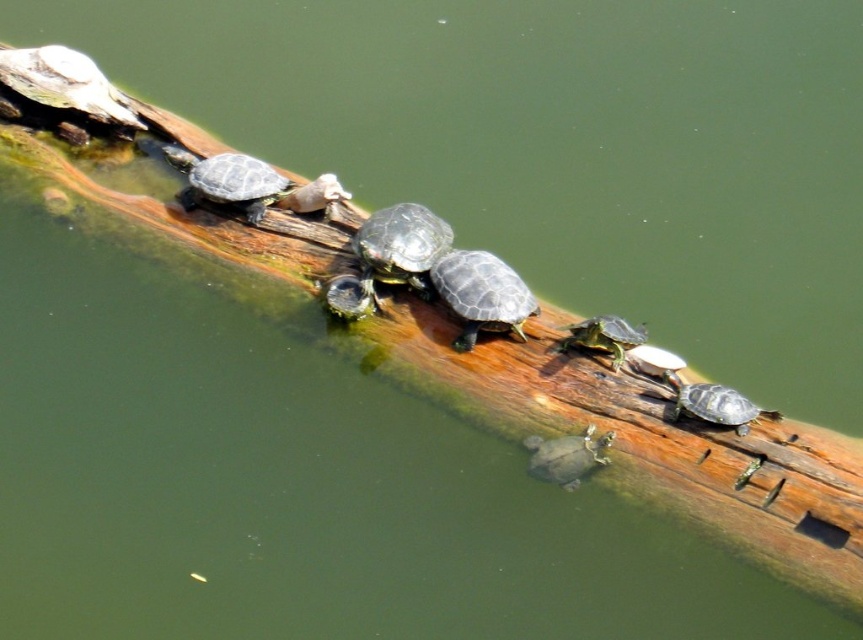
You are observing a log with turtles resting on it. There are two points marked on the log at coordinates point (498, 285) and point (334, 275). If you were to walk towards the log, which point would appear closer to you?

Point (498, 285) is closer to the viewer than point (334, 275), so it would appear closer when approaching the log.

You are a wildlife photographer aiming to capture both the smooth dark gray tortoise at center and the green matte turtle at center in a single shot. Based on their positions, which turtle is positioned to the right side of the other?

The smooth dark gray tortoise at center is positioned to the right of the green matte turtle at center.